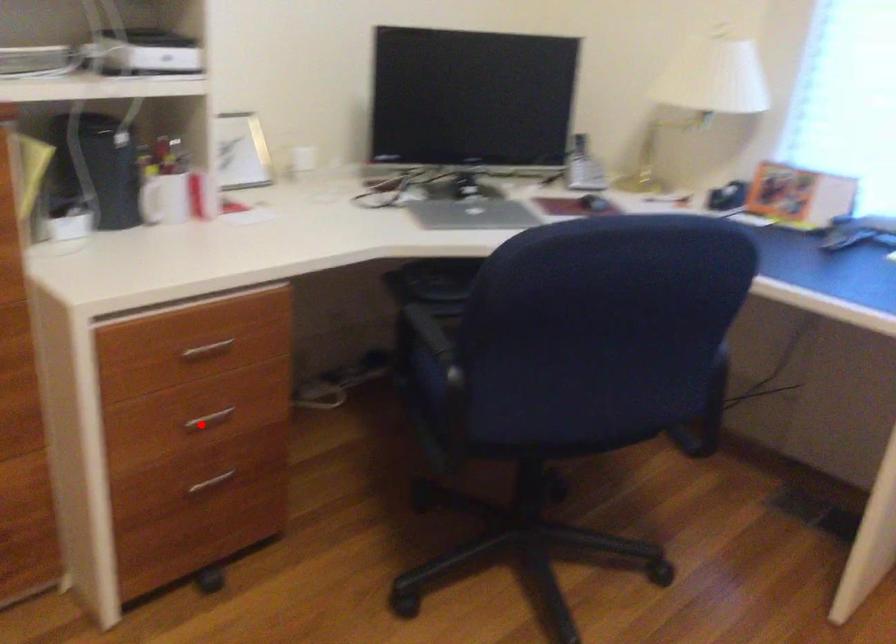
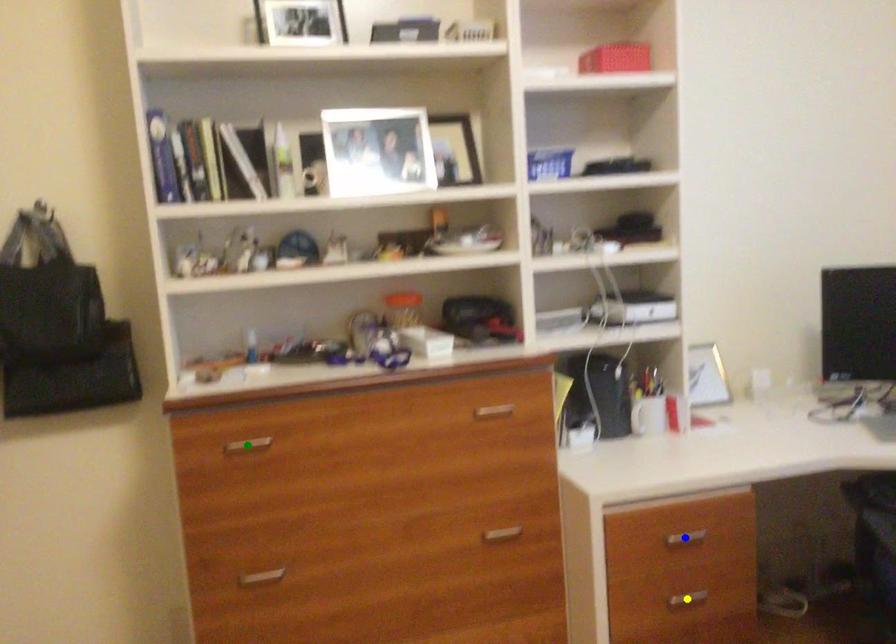
Question: I am providing you with two images of the same scene from different viewpoints. A red point is marked on the first image. You are given multiple points on the second image. Can you choose the point in image 2 that corresponds to the point in image 1?

Choices:
 (A) blue point
 (B) yellow point
 (C) green point

Answer: (B)